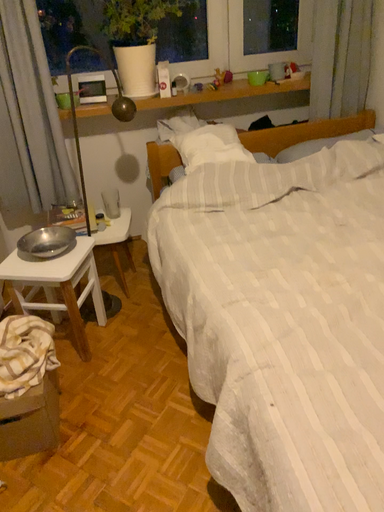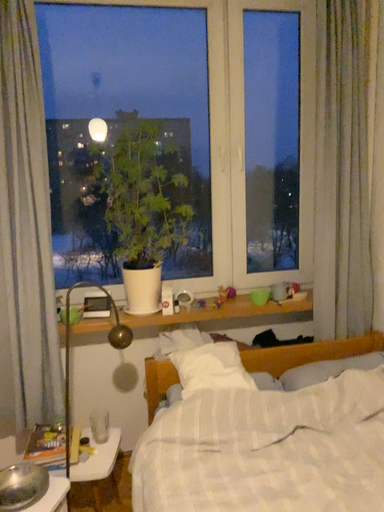
Question: How did the camera likely rotate when shooting the video?

Choices:
 (A) rotated downward
 (B) rotated upward

Answer: (B)